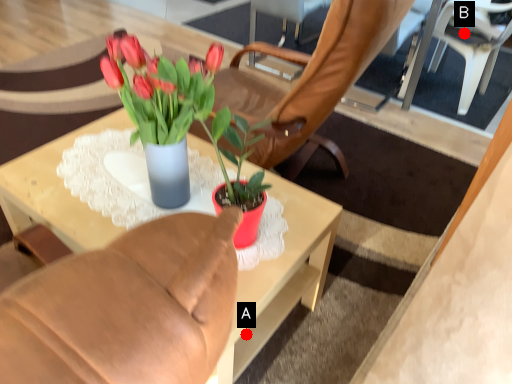
Question: Two points are circled on the image, labeled by A and B beside each circle. Which point is closer to the camera?

Choices:
 (A) A is closer
 (B) B is closer

Answer: (A)